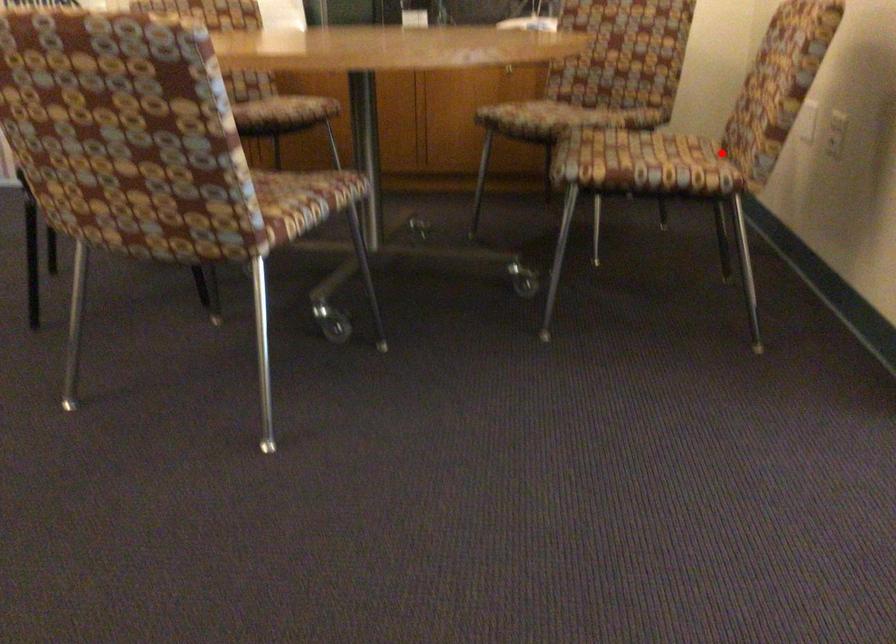
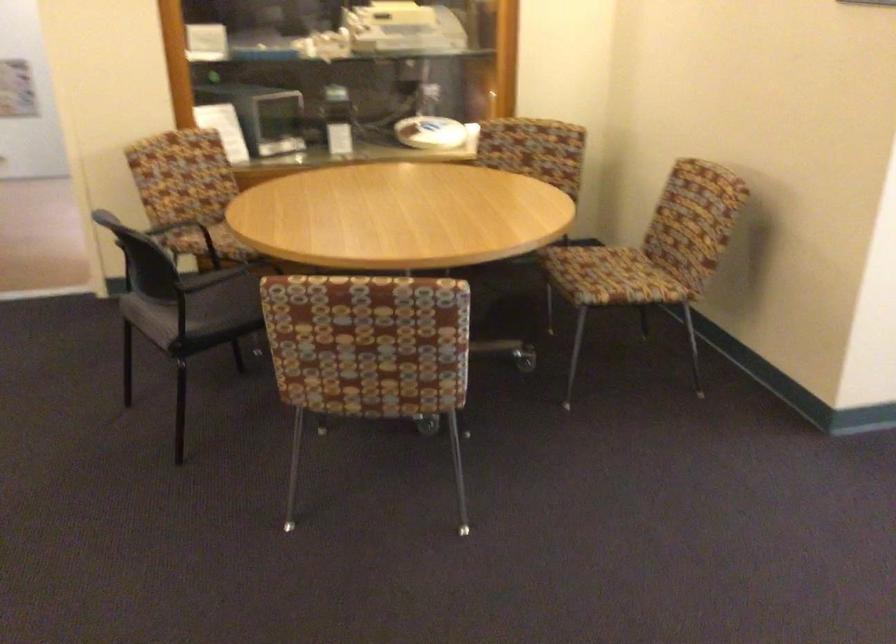
Question: I am providing you with two images of the same scene from different viewpoints. A red point is shown in image1. For the corresponding object point in image2, is it positioned nearer or farther from the camera?

Choices:
 (A) Nearer
 (B) Farther

Answer: (B)